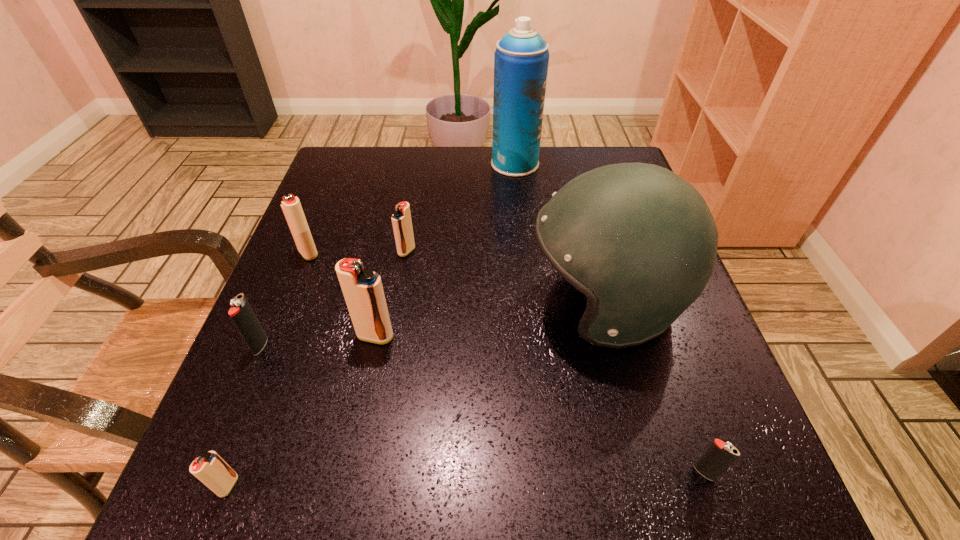
Locate an element on the screen. free space between the third biggest red igniter and the second tallest igniter is located at coordinates (357, 252).

This screenshot has width=960, height=540. Find the location of `object that is the second closest to the nearest red igniter`. object that is the second closest to the nearest red igniter is located at coordinates (362, 288).

Identify the location of object that is the fifth closest to the left black igniter. The height and width of the screenshot is (540, 960). click(x=640, y=242).

Select which igniter appears as the fifth closest to the bigger black igniter. Please provide its 2D coordinates. Your answer should be formatted as a tuple, i.e. [(x, y)], where the tuple contains the x and y coordinates of a point satisfying the conditions above.

[(719, 455)]

Identify which igniter is located as the fourth nearest to the farthest object. Please provide its 2D coordinates. Your answer should be formatted as a tuple, i.e. [(x, y)], where the tuple contains the x and y coordinates of a point satisfying the conditions above.

[(241, 313)]

Select which red igniter is the second closest to the tallest igniter. Please provide its 2D coordinates. Your answer should be formatted as a tuple, i.e. [(x, y)], where the tuple contains the x and y coordinates of a point satisfying the conditions above.

[(291, 206)]

Locate an element on the screen. The image size is (960, 540). red igniter that is the third closest one to the farther black igniter is located at coordinates (210, 469).

At what (x,y) coordinates should I click in order to perform the action: click on blank area in the image that satisfies the following two spatial constraints: 1. on the front side of the right black igniter; 2. on the right side of the sixth shortest object. Please return your answer as a coordinate pair (x, y). Looking at the image, I should click on (348, 472).

Locate an element on the screen. The image size is (960, 540). free space that satisfies the following two spatial constraints: 1. on the back side of the nearer black igniter; 2. at the face opening of the football helmet is located at coordinates pyautogui.click(x=646, y=303).

Image resolution: width=960 pixels, height=540 pixels. I want to click on free location that satisfies the following two spatial constraints: 1. on the front side of the bigger black igniter; 2. on the left side of the nearest red igniter, so click(203, 485).